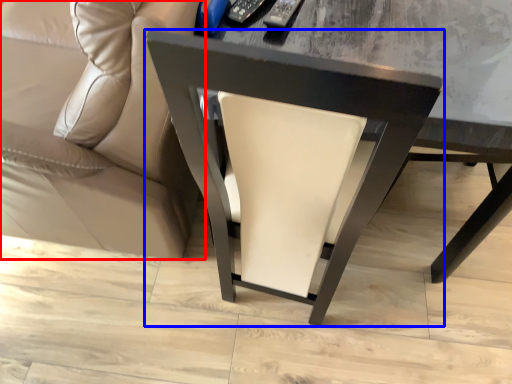
Question: Which object is further to the camera taking this photo, studio couch (highlighted by a red box) or chair (highlighted by a blue box)?

Choices:
 (A) studio couch
 (B) chair

Answer: (B)